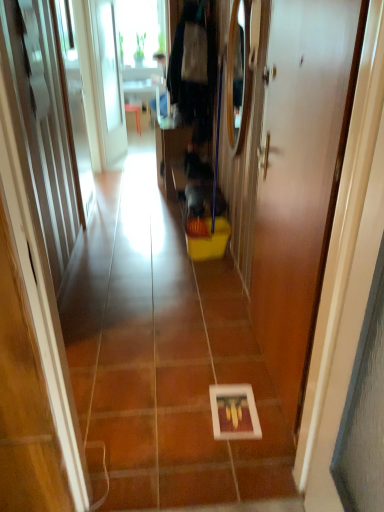
Question: From a real-world perspective, is white glossy picture frame at center above or below white glossy door at center?

Choices:
 (A) below
 (B) above

Answer: (A)

Question: Choose the correct answer: Is white glossy picture frame at center inside white glossy door at center or outside it?

Choices:
 (A) inside
 (B) outside

Answer: (B)

Question: From the image's perspective, relative to white glossy door at center, is white glossy picture frame at center above or below?

Choices:
 (A) below
 (B) above

Answer: (B)

Question: Does point (324, 61) appear closer or farther from the camera than point (173, 428)?

Choices:
 (A) farther
 (B) closer

Answer: (B)

Question: In terms of height, does white glossy door at center look taller or shorter compared to white glossy picture frame at center?

Choices:
 (A) tall
 (B) short

Answer: (A)

Question: Based on their sizes in the image, would you say white glossy door at center is bigger or smaller than white glossy picture frame at center?

Choices:
 (A) big
 (B) small

Answer: (B)

Question: In the image, is white glossy door at center positioned in front of or behind white glossy picture frame at center?

Choices:
 (A) behind
 (B) front

Answer: (B)